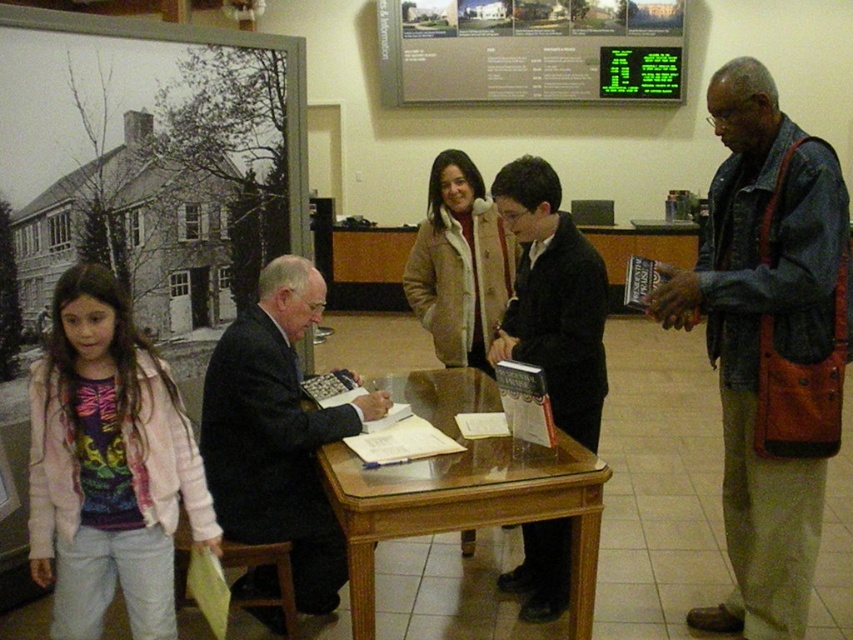
Question: Which of the following is the farthest from the observer?

Choices:
 (A) denim jacket at right
 (B) light pink fleece jacket at left
 (C) green digital display at upper center

Answer: (C)

Question: Is green digital display at upper center positioned at the back of black suit jacket at center?

Choices:
 (A) yes
 (B) no

Answer: (A)

Question: Which point is closer to the camera taking this photo?

Choices:
 (A) coord(585,588)
 (B) coord(726,369)
 (C) coord(291,451)

Answer: (A)

Question: Among these points, which one is farthest from the camera?

Choices:
 (A) (262, 572)
 (B) (351, 480)
 (C) (196, 467)

Answer: (A)

Question: Is light pink fleece jacket at left positioned in front of black suit at center?

Choices:
 (A) yes
 (B) no

Answer: (A)

Question: Is denim jacket at right thinner than black suit jacket at center?

Choices:
 (A) no
 (B) yes

Answer: (A)